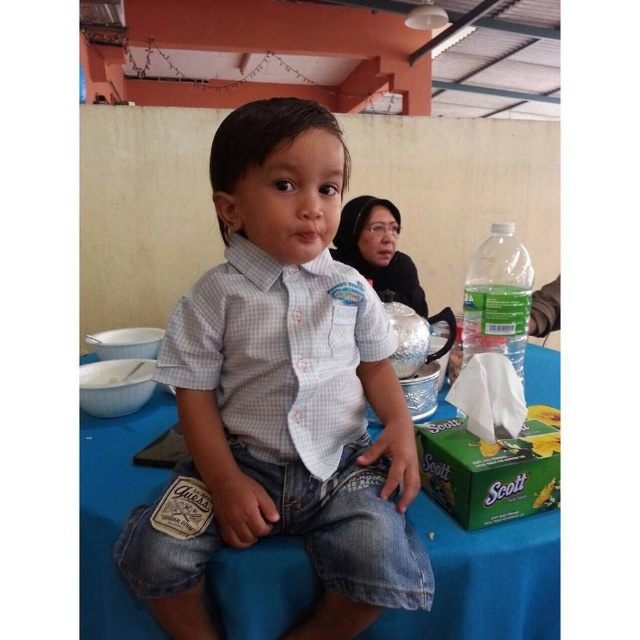
Does point (92, 417) come closer to viewer compared to point (528, 314)?

No, (92, 417) is behind (528, 314).

Can you confirm if blue fabric table at center is taller than clear plastic bottle at right?

Indeed, blue fabric table at center has a greater height compared to clear plastic bottle at right.

Is point (83, 417) positioned in front of point (468, 324)?

No, (83, 417) is further to viewer.

Where is `blue fabric table at center`? Image resolution: width=640 pixels, height=640 pixels. blue fabric table at center is located at coordinates (483, 580).

Is point (385, 540) less distant than point (461, 346)?

Yes, it is.

Find the location of a particular element. The height and width of the screenshot is (640, 640). light blue checkered shirt at center is located at coordinates (284, 392).

The image size is (640, 640). In order to click on light blue checkered shirt at center in this screenshot , I will do `click(284, 392)`.

Is light blue checkered shirt at center thinner than blue fabric table at center?

Indeed, light blue checkered shirt at center has a lesser width compared to blue fabric table at center.

At what (x,y) coordinates should I click in order to perform the action: click on light blue checkered shirt at center. Please return your answer as a coordinate pair (x, y). The height and width of the screenshot is (640, 640). Looking at the image, I should click on (284, 392).